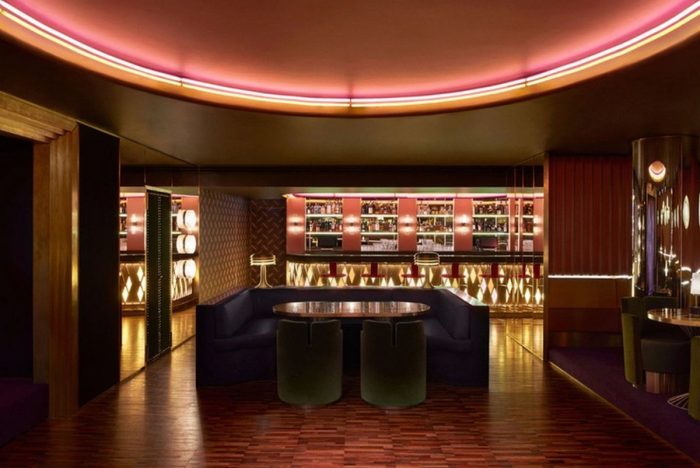
At what (x,y) coordinates should I click in order to perform the action: click on horizontal light bar. Please return your answer as a coordinate pair (x, y). Looking at the image, I should click on (584, 275).